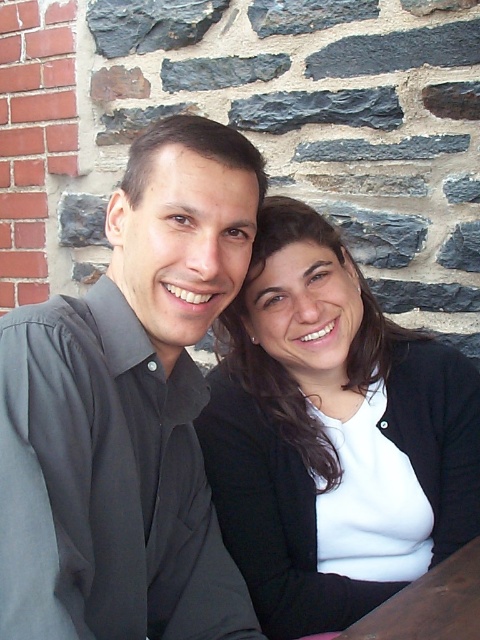
Is white matte/black textured blazer at center shorter than brown wooden table at lower right?

No.

Who is positioned more to the right, white matte/black textured blazer at center or brown wooden table at lower right?

brown wooden table at lower right is more to the right.

You are a GUI agent. You are given a task and a screenshot of the screen. Output one action in this format:
    pyautogui.click(x=<x>, y=<y>)
    Task: Click on the white matte/black textured blazer at center
    This screenshot has height=640, width=480.
    Given the screenshot: What is the action you would take?
    pyautogui.click(x=333, y=435)

Where is `white matte/black textured blazer at center`? This screenshot has height=640, width=480. white matte/black textured blazer at center is located at coordinates (333, 435).

Is point (100, 280) positioned before point (435, 605)?

No, it is behind (435, 605).

Is point (97, 369) farther from camera compared to point (458, 636)?

Yes, point (97, 369) is farther from viewer.

Does point (149, 433) come closer to viewer compared to point (475, 541)?

Yes, point (149, 433) is closer to viewer.

The width and height of the screenshot is (480, 640). Find the location of `black shirt at left`. black shirt at left is located at coordinates (128, 410).

This screenshot has height=640, width=480. Describe the element at coordinates (128, 410) in the screenshot. I see `black shirt at left` at that location.

Looking at this image, does black shirt at left have a greater width compared to white matte/black textured blazer at center?

No.

Between point (22, 401) and point (295, 504), which one is positioned in front?

Point (22, 401) is in front.

Identify the location of black shirt at left. (128, 410).